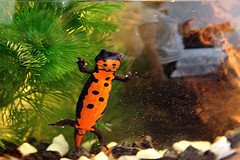
Find the location of a particular element. This screenshot has width=240, height=160. left front leg is located at coordinates (126, 80).